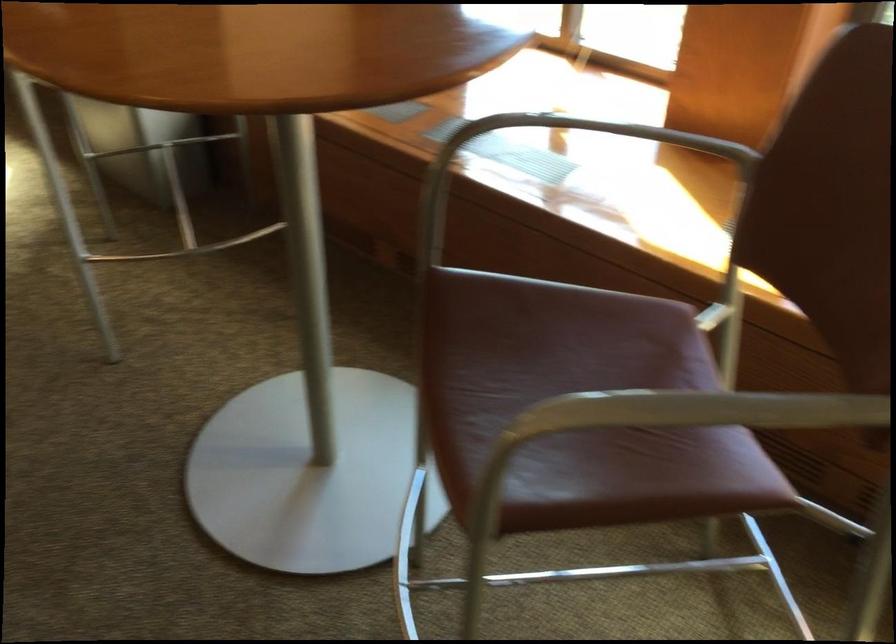
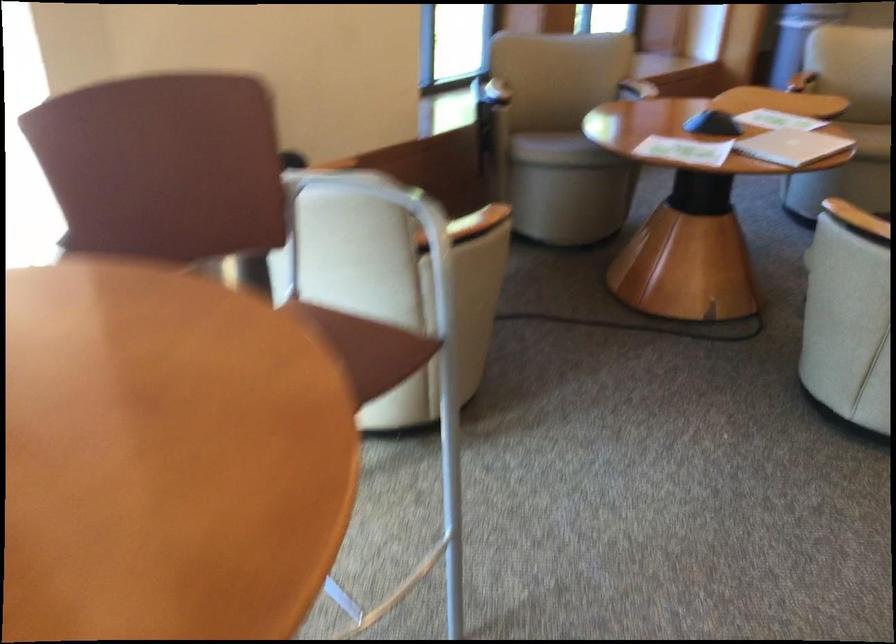
Question: I am providing you with two images of the same scene from different viewpoints. After the viewpoint changes to image2, which objects are now occluded?

Choices:
 (A) beige chair sitting surface
 (B) reddish brown pillow
 (C) chair sitting surface
 (D) wooden chair armrest

Answer: (C)